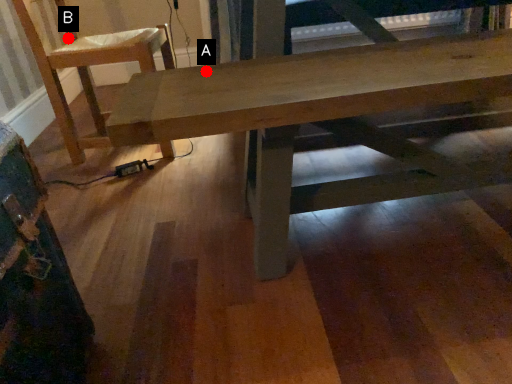
Question: Two points are circled on the image, labeled by A and B beside each circle. Which of the following is the closest to the observer?

Choices:
 (A) A is closer
 (B) B is closer

Answer: (A)